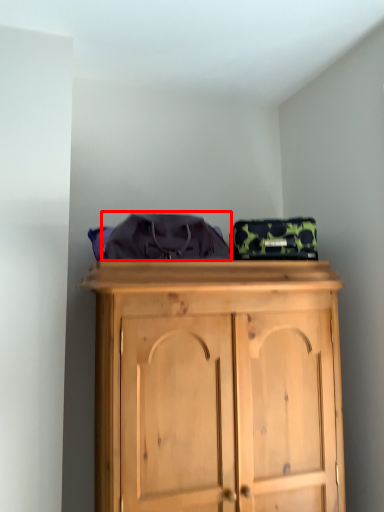
Question: From the image's perspective, considering the relative positions of clothing (annotated by the red box) and bag in the image provided, where is clothing (annotated by the red box) located with respect to the staircase?

Choices:
 (A) above
 (B) below

Answer: (A)